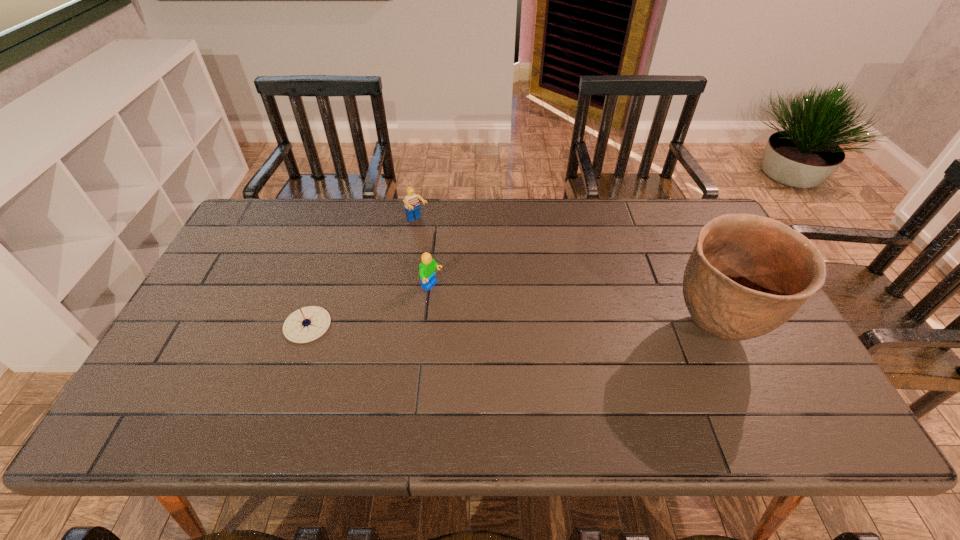
Find the location of a particular element. This screenshot has height=540, width=960. free space at the left edge of the desktop is located at coordinates (236, 264).

The height and width of the screenshot is (540, 960). I want to click on free spot at the near left corner of the desktop, so click(x=156, y=381).

Locate an element on the screen. This screenshot has height=540, width=960. empty space that is in between the shortest object and the nearer Lego is located at coordinates (370, 306).

Find the location of a particular element. The width and height of the screenshot is (960, 540). unoccupied area between the pottery and the leftmost object is located at coordinates (511, 327).

The height and width of the screenshot is (540, 960). I want to click on free space that is in between the nearer Lego and the rightmost object, so click(x=573, y=307).

Where is `free spot between the nearer Lego and the compass`? Image resolution: width=960 pixels, height=540 pixels. free spot between the nearer Lego and the compass is located at coordinates (370, 306).

Where is `vacant region between the nearer Lego and the compass`? This screenshot has width=960, height=540. vacant region between the nearer Lego and the compass is located at coordinates (370, 306).

In order to click on vacant area that lies between the tallest object and the farther Lego in this screenshot , I will do `click(565, 275)`.

You are a GUI agent. You are given a task and a screenshot of the screen. Output one action in this format:
    pyautogui.click(x=<x>, y=<y>)
    Task: Click on the empty space that is in between the tallest object and the nearer Lego
    This screenshot has width=960, height=540.
    Given the screenshot: What is the action you would take?
    pyautogui.click(x=573, y=307)

Locate an element on the screen. vacant area between the farthest object and the compass is located at coordinates (363, 273).